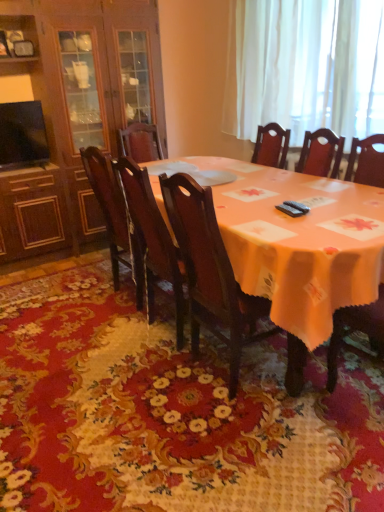
The height and width of the screenshot is (512, 384). What are the coordinates of `free space in front of polished dark wood chair at center, marked as the 1th chair in a left-to-right arrangement` in the screenshot? It's located at (105, 333).